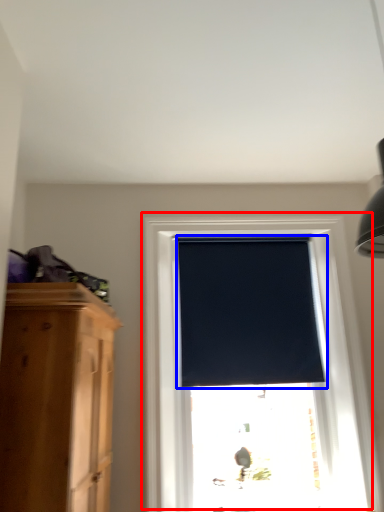
Question: Among these objects, which one is nearest to the camera, window (highlighted by a red box) or window blind (highlighted by a blue box)?

Choices:
 (A) window
 (B) window blind

Answer: (A)